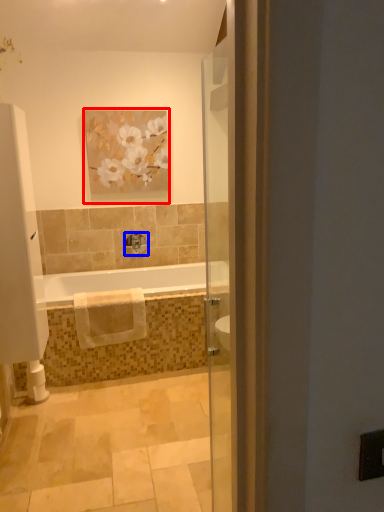
Question: Which object is closer to the camera taking this photo, picture frame (highlighted by a red box) or tap (highlighted by a blue box)?

Choices:
 (A) picture frame
 (B) tap

Answer: (A)